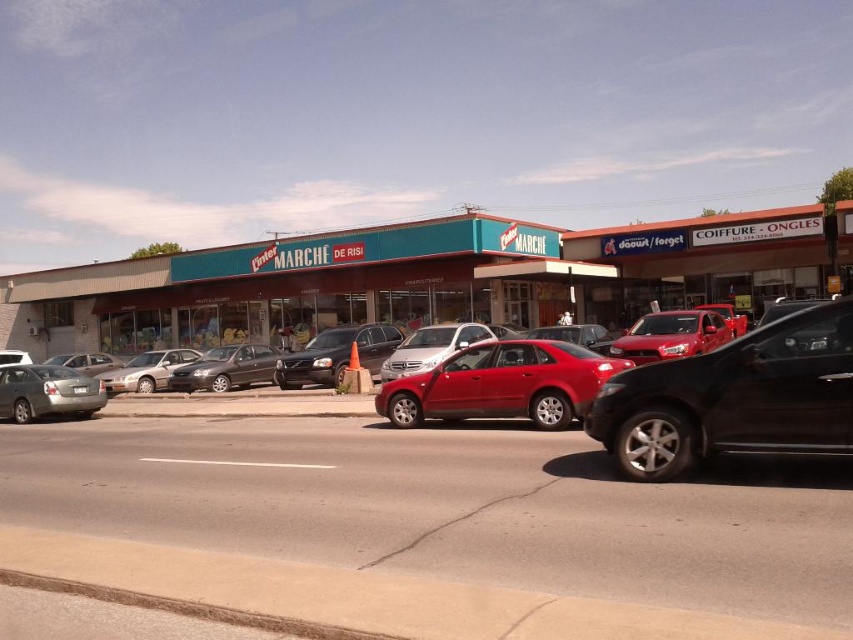
You are a delivery person needing to park your 2.5 meter wide van between the black metallic sedan at center and the glossy red sedan at center. Can you fit your van between them?

The black metallic sedan at center is smaller than the glossy red sedan at center, but the exact distance between them isn not provided. Without knowing the space between the two sedans, it is impossible to determine if the van will fit.